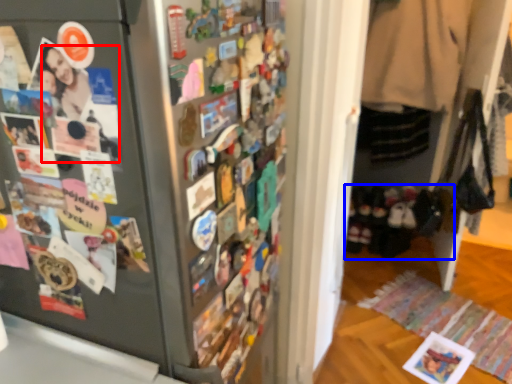
Question: Which point is further to the camera, person (highlighted by a red box) or footwear (highlighted by a blue box)?

Choices:
 (A) person
 (B) footwear

Answer: (B)